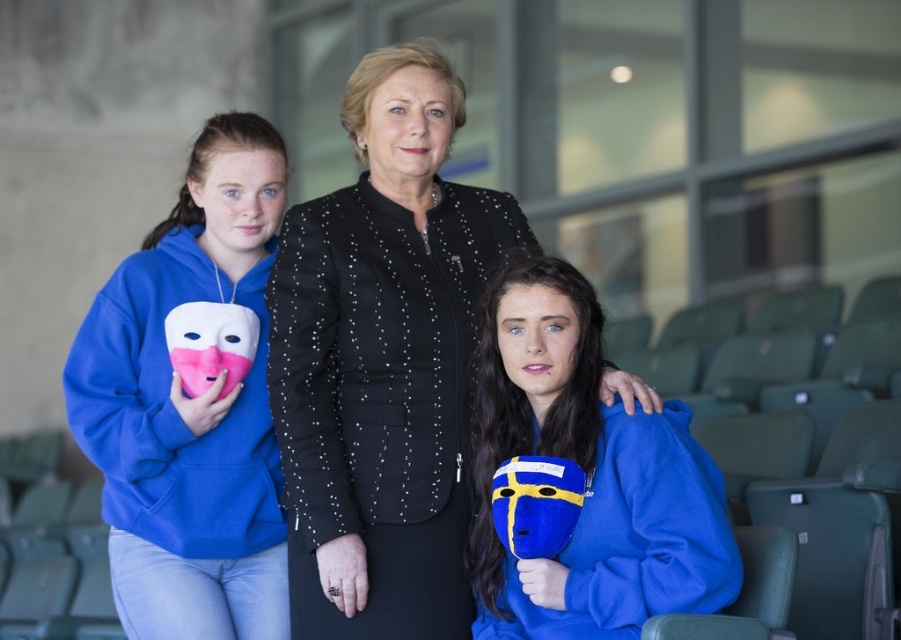
Question: Which object is the farthest from the blue matte mask at center?

Choices:
 (A) matte blue mask at left
 (B) smooth black face at center
 (C) black textured jacket at center

Answer: (A)

Question: Which of the following is the closest to the observer?

Choices:
 (A) blue fleece mask at left
 (B) matte blue mask at left
 (C) blue fleece sweatshirt at center
 (D) velvet blue mask at center

Answer: (D)

Question: Is blue fleece mask at left positioned in front of blue fleece sweatshirt at center?

Choices:
 (A) no
 (B) yes

Answer: (A)

Question: Is smooth black face at center to the right of matte blue mask at left from the viewer's perspective?

Choices:
 (A) yes
 (B) no

Answer: (A)

Question: Among these objects, which one is nearest to the camera?

Choices:
 (A) velvet blue mask at center
 (B) black textured jacket at center

Answer: (A)

Question: Can you confirm if black textured jacket at center is positioned to the left of matte blue mask at left?

Choices:
 (A) no
 (B) yes

Answer: (A)